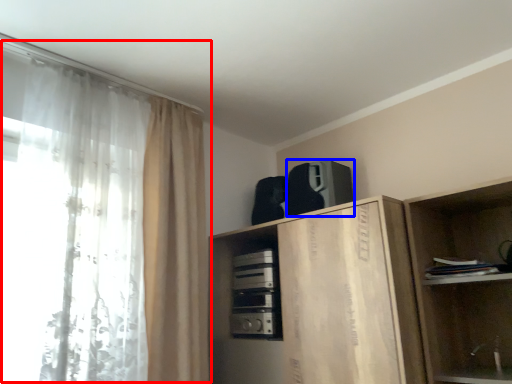
Question: Among these objects, which one is nearest to the camera, curtain (highlighted by a red box) or appliance (highlighted by a blue box)?

Choices:
 (A) curtain
 (B) appliance

Answer: (A)